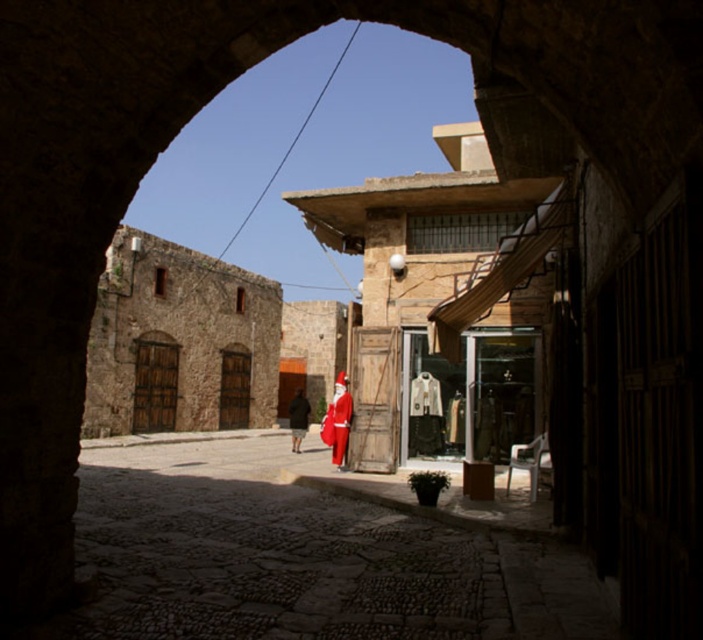
Can you confirm if red matte santa suit at center is wider than red velvet santa suit at center?

Indeed, red matte santa suit at center has a greater width compared to red velvet santa suit at center.

Does red matte santa suit at center come in front of red velvet santa suit at center?

Yes.

You are a GUI agent. You are given a task and a screenshot of the screen. Output one action in this format:
    pyautogui.click(x=<x>, y=<y>)
    Task: Click on the red matte santa suit at center
    The width and height of the screenshot is (703, 640).
    Given the screenshot: What is the action you would take?
    pyautogui.click(x=337, y=420)